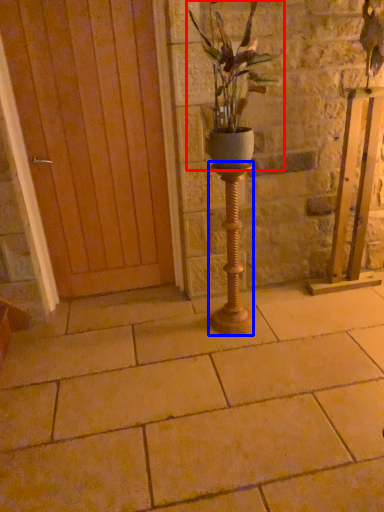
Question: Among these objects, which one is farthest to the camera, houseplant (highlighted by a red box) or candle holder (highlighted by a blue box)?

Choices:
 (A) houseplant
 (B) candle holder

Answer: (B)